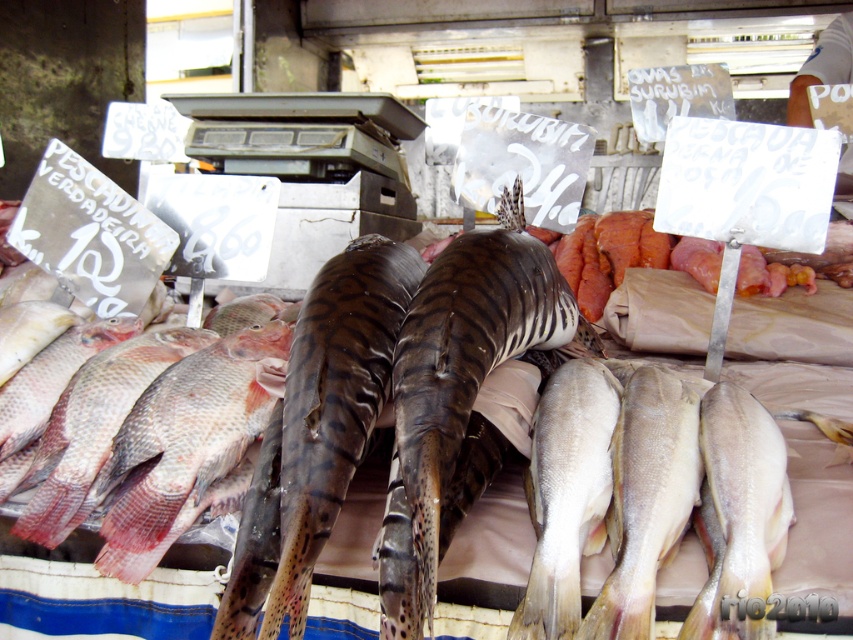
Is dark brown spotted shark at center behind pinkish matte fish at lower left?

No, it is not.

Does dark brown spotted shark at center have a smaller size compared to pinkish matte fish at lower left?

Incorrect, dark brown spotted shark at center is not smaller in size than pinkish matte fish at lower left.

What do you see at coordinates (457, 396) in the screenshot?
I see `dark brown spotted shark at center` at bounding box center [457, 396].

I want to click on dark brown spotted shark at center, so click(457, 396).

Is dark brown spotted shark at center positioned in front of pinkish matte fish at left?

Yes.

Which is below, dark brown spotted shark at center or pinkish matte fish at left?

Positioned lower is pinkish matte fish at left.

Where is `dark brown spotted shark at center`? dark brown spotted shark at center is located at coordinates (457, 396).

Between dark brown spotted shark at center and white smooth fish at center, which one has more height?

With more height is dark brown spotted shark at center.

Is the position of dark brown spotted shark at center more distant than that of white smooth fish at center?

No, dark brown spotted shark at center is closer to the viewer.

Identify the location of dark brown spotted shark at center. This screenshot has height=640, width=853. (457, 396).